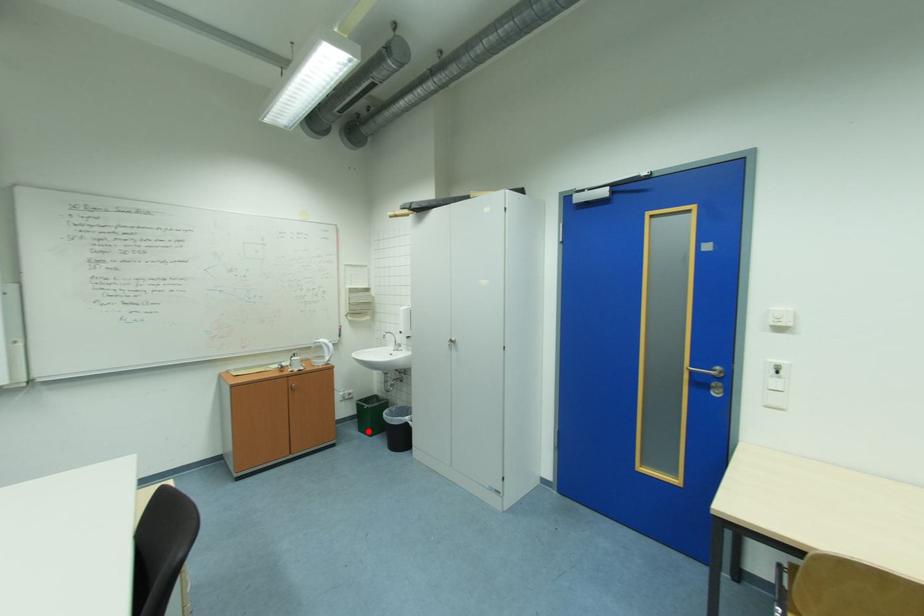
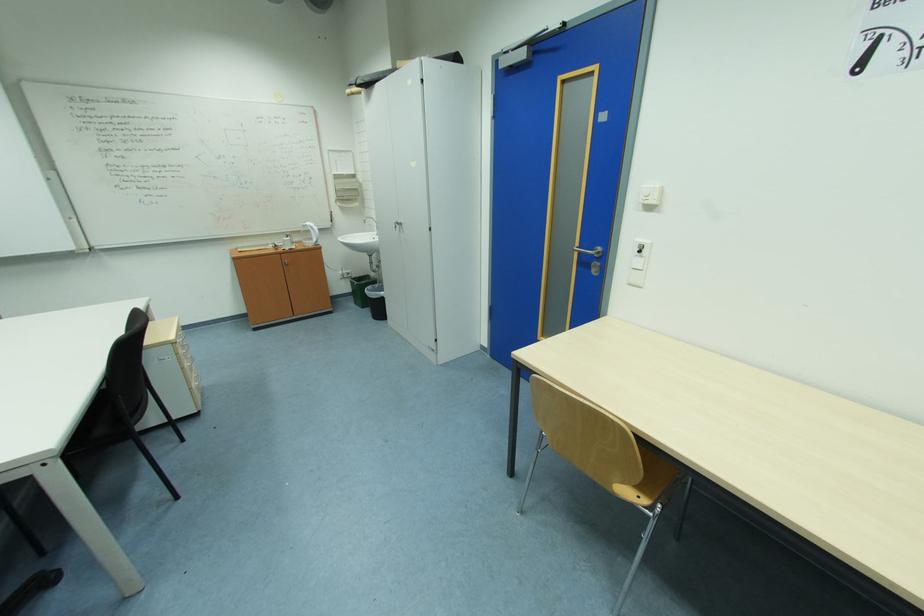
Find the pixel in the second image that matches the highlighted location in the first image.

(362, 304)